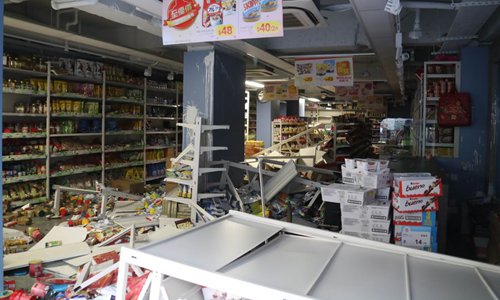
Where is `air duct`? air duct is located at coordinates (344, 32), (129, 37).